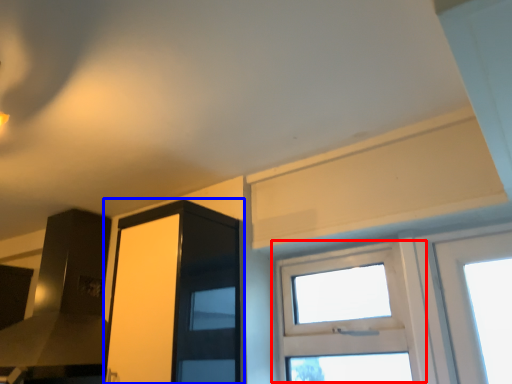
Question: Which point is further to the camera, window (highlighted by a red box) or screen door (highlighted by a blue box)?

Choices:
 (A) window
 (B) screen door

Answer: (A)